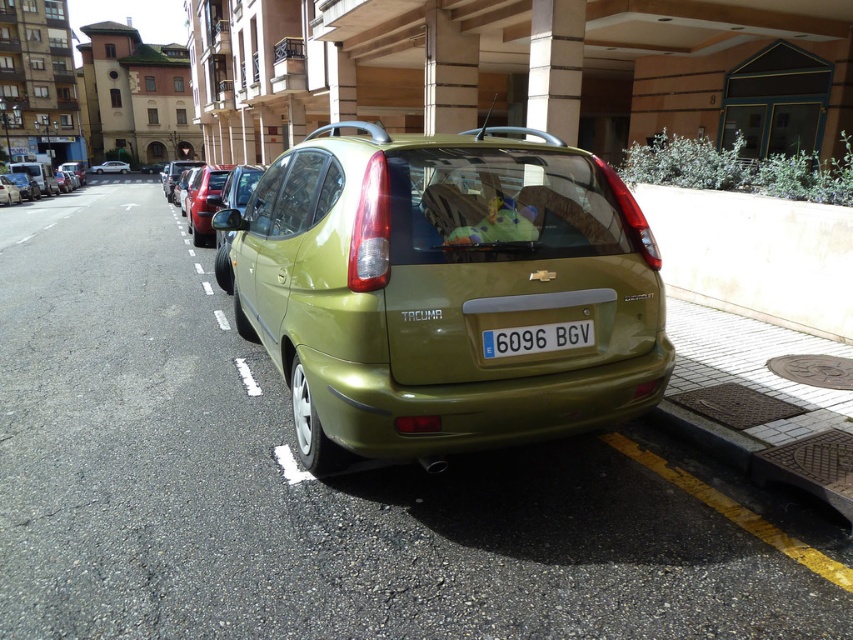
You are standing on the sidewalk and want to cross the street to reach the olive metallic sedan at center. The crosswalk is 10 feet away from you. Can you safely walk to the sedan without needing to go further than the crosswalk?

The olive metallic sedan at center is 9.16 feet away from the viewer. Since the crosswalk is 10 feet away, you can safely reach the sedan within the crosswalk distance.

You are a delivery driver who needs to park your vehicle in the parking space next to the olive metallic sedan at center. The parking space is marked by white lines. Can you safely park your car without hitting the white plastic license plate at center?

The olive metallic sedan at center is to the left of the white plastic license plate at center. Since the parking space is marked by white lines, you should be able to park safely without hitting the license plate as long as you stay within the designated lines.

You are a delivery driver who needs to park your truck between the matte green hatchback at center and the metallic silver car at center. Based on the scene, can your truck fit in the space between them?

The matte green hatchback at center is shorter than the metallic silver car at center, so the space between them may be sufficient for your truck depending on the exact dimensions. However, since the description only mentions their lengths, you should measure the distance between the two vehicles to ensure your truck can fit safely.